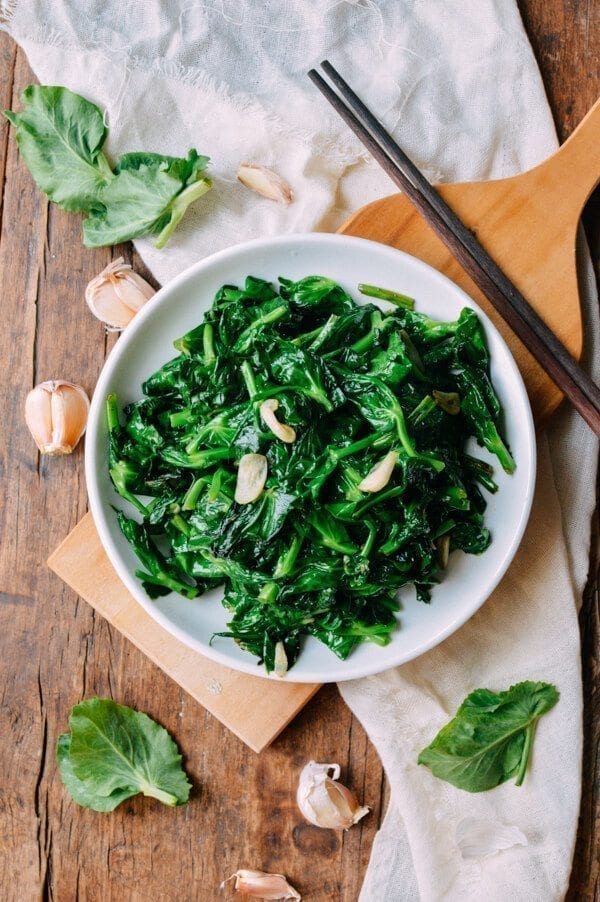
This screenshot has width=600, height=902. I want to click on table, so (x=47, y=652), (x=579, y=58), (x=592, y=223), (x=586, y=637), (x=9, y=67).